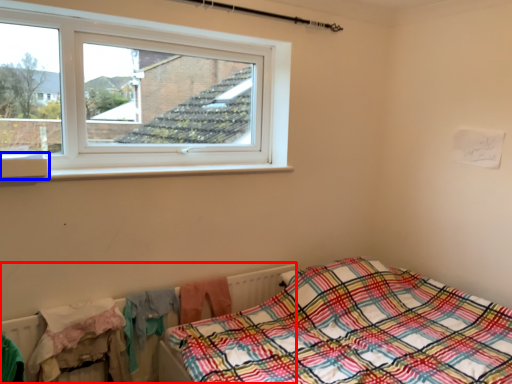
Question: Which object appears closest to the camera in this image, radiator (highlighted by a red box) or window sill (highlighted by a blue box)?

Choices:
 (A) radiator
 (B) window sill

Answer: (B)